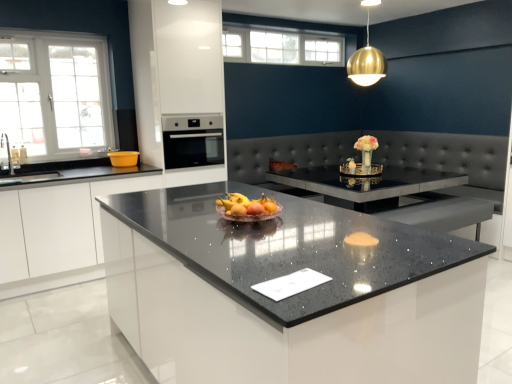
What is the approximate height of gold metallic sphere at upper center?

It is 31.35 inches.

Describe the element at coordinates (288, 248) in the screenshot. I see `sparkling granite countertop at center` at that location.

This screenshot has width=512, height=384. I want to click on white glass window at upper center, arranged as the second window when viewed from the front, so click(283, 45).

The width and height of the screenshot is (512, 384). What do you see at coordinates (59, 224) in the screenshot? I see `white glossy cabinet at left` at bounding box center [59, 224].

This screenshot has width=512, height=384. What do you see at coordinates (55, 93) in the screenshot?
I see `white glass window at upper left, the 1th window in the front-to-back sequence` at bounding box center [55, 93].

At what (x,y) coordinates should I click in order to perform the action: click on gold metallic sphere at upper center. Please return your answer as a coordinate pair (x, y). The width and height of the screenshot is (512, 384). Looking at the image, I should click on [x=367, y=58].

Which is less distant, (106, 167) or (226, 52)?

Point (106, 167) is closer to the camera than point (226, 52).

Is white glossy cabinet at left wider than white glass window at upper center, placed as the second window when sorted from bottom to top?

Indeed, white glossy cabinet at left has a greater width compared to white glass window at upper center, placed as the second window when sorted from bottom to top.

From a real-world perspective, which object stands above the other?

white glass window at upper center, the 1th window positioned from the top, is physically above.

What's the angular difference between white glossy cabinet at left and white glass window at upper center, placed as the second window when sorted from bottom to top,'s facing directions?

They differ by 0.0285 degrees in their facing directions.

What are the coordinates of `oven on the left side of gold metallic sphere at upper center` in the screenshot? It's located at (192, 140).

Does satin black oven at center have a lesser width compared to gold metallic sphere at upper center?

No, satin black oven at center is not thinner than gold metallic sphere at upper center.

Is satin black oven at center positioned with its back to gold metallic sphere at upper center?

That's not correct — satin black oven at center is not looking away from gold metallic sphere at upper center.

In terms of size, does sparkling granite countertop at center appear bigger or smaller than gold metallic sphere at upper center?

sparkling granite countertop at center is bigger than gold metallic sphere at upper center.

Is point (293, 310) farther from camera compared to point (350, 63)?

That is False.

Who is shorter, sparkling granite countertop at center or gold metallic sphere at upper center?

gold metallic sphere at upper center is shorter.

At what (x,y) coordinates should I click in order to perform the action: click on light fixture above the sparkling granite countertop at center (from a real-world perspective). Please return your answer as a coordinate pair (x, y). This screenshot has width=512, height=384. Looking at the image, I should click on (367, 58).

From a real-world perspective, is gold metallic sphere at upper center positioned over satin black oven at center based on gravity?

Indeed, from a real-world perspective, gold metallic sphere at upper center stands above satin black oven at center.

Looking at this image, is gold metallic sphere at upper center facing towards satin black oven at center?

No, gold metallic sphere at upper center does not turn towards satin black oven at center.

Considering the relative sizes of gold metallic sphere at upper center and satin black oven at center in the image provided, is gold metallic sphere at upper center wider than satin black oven at center?

No, gold metallic sphere at upper center is not wider than satin black oven at center.

Which is in front, point (369, 47) or point (216, 158)?

The point (369, 47) is more forward.

From a real-world perspective, is satin black oven at center positioned above or below white glossy cabinet at left?

In terms of real-world spatial position, satin black oven at center is above white glossy cabinet at left.

Is satin black oven at center not near white glossy cabinet at left?

No, satin black oven at center is not far away from white glossy cabinet at left.

Could you tell me if satin black oven at center is turned towards white glossy cabinet at left?

No, satin black oven at center does not turn towards white glossy cabinet at left.

Which is closer to the camera, (175, 118) or (75, 201)?

Point (175, 118) is farther from the camera than point (75, 201).

Considering the sizes of white glossy cabinet at left and gold metallic sphere at upper center in the image, is white glossy cabinet at left taller or shorter than gold metallic sphere at upper center?

Clearly, white glossy cabinet at left is taller compared to gold metallic sphere at upper center.

Considering the points (58, 228) and (357, 58), which point is behind, point (58, 228) or point (357, 58)?

The point (357, 58) is more distant.

Is white glossy cabinet at left positioned far away from gold metallic sphere at upper center?

white glossy cabinet at left is positioned a significant distance from gold metallic sphere at upper center.

Does white glass window at upper left, the 1th window in the front-to-back sequence, have a lesser width compared to white glass window at upper center, arranged as the second window when viewed from the front?

No, white glass window at upper left, the 1th window in the front-to-back sequence, is not thinner than white glass window at upper center, arranged as the second window when viewed from the front.

Is white glass window at upper left, arranged as the second window when viewed from the top, directly adjacent to white glass window at upper center, placed as the first window when sorted from right to left?

white glass window at upper left, arranged as the second window when viewed from the top, is not next to white glass window at upper center, placed as the first window when sorted from right to left, and they're not touching.

From the picture: Would you say white glass window at upper left, the 1th window in the front-to-back sequence, is to the left or to the right of white glass window at upper center, placed as the second window when sorted from bottom to top, in the picture?

white glass window at upper left, the 1th window in the front-to-back sequence, is to the left of white glass window at upper center, placed as the second window when sorted from bottom to top.

Locate an element on the screen. window below the white glass window at upper center, arranged as the second window when viewed from the front (from the image's perspective) is located at coordinates (55, 93).

This screenshot has height=384, width=512. Identify the location of cabinetry below the white glass window at upper center, placed as the first window when sorted from right to left (from the image's perspective). (59, 224).

Locate an element on the screen. The image size is (512, 384). oven behind the gold metallic sphere at upper center is located at coordinates (192, 140).

Estimate the real-world distances between objects in this image. Which object is further from white glass window at upper left, arranged as the first window when ordered from the bottom, sparkling granite countertop at center or gold metallic sphere at upper center?

gold metallic sphere at upper center is further to white glass window at upper left, arranged as the first window when ordered from the bottom.

When comparing their distances from white glass window at upper center, the 1th window positioned from the top, does sparkling granite countertop at center or white glass window at upper left, which is the 2th window from right to left, seem closer?

The object closer to white glass window at upper center, the 1th window positioned from the top, is white glass window at upper left, which is the 2th window from right to left.

Estimate the real-world distances between objects in this image. Which object is closer to sparkling granite countertop at center, white glass window at upper left, arranged as the first window when ordered from the bottom, or satin black oven at center?

satin black oven at center.

Based on their spatial positions, is sparkling granite countertop at center or white glass window at upper left, which is the 1th window in left-to-right order, further from gold metallic sphere at upper center?

white glass window at upper left, which is the 1th window in left-to-right order.

Looking at the image, which one is located further to white glossy cabinet at left, white glass window at upper center, the second window when ordered from left to right, or white glass window at upper left, arranged as the second window when viewed from the top?

white glass window at upper center, the second window when ordered from left to right, lies further to white glossy cabinet at left than the other object.

When comparing their distances from gold metallic sphere at upper center, does white glass window at upper center, placed as the second window when sorted from bottom to top, or white glossy cabinet at left seem closer?

white glass window at upper center, placed as the second window when sorted from bottom to top, lies closer to gold metallic sphere at upper center than the other object.

Based on their spatial positions, is white glass window at upper left, arranged as the second window when viewed from the top, or gold metallic sphere at upper center further from sparkling granite countertop at center?

The object further to sparkling granite countertop at center is gold metallic sphere at upper center.

Based on their spatial positions, is gold metallic sphere at upper center or white glass window at upper left, the 1th window in the front-to-back sequence, closer to satin black oven at center?

white glass window at upper left, the 1th window in the front-to-back sequence.

I want to click on cabinetry between white glass window at upper left, which is the 2th window from back to front, and gold metallic sphere at upper center, in the horizontal direction, so click(59, 224).

Locate an element on the screen. light fixture positioned between sparkling granite countertop at center and white glass window at upper center, which ranks as the 1th window in back-to-front order, from near to far is located at coordinates (367, 58).

At what (x,y) coordinates should I click in order to perform the action: click on oven located between white glossy cabinet at left and gold metallic sphere at upper center in the left-right direction. Please return your answer as a coordinate pair (x, y). Looking at the image, I should click on (192, 140).

I want to click on light fixture located between sparkling granite countertop at center and white glass window at upper left, the 1th window in the front-to-back sequence, in the depth direction, so click(367, 58).